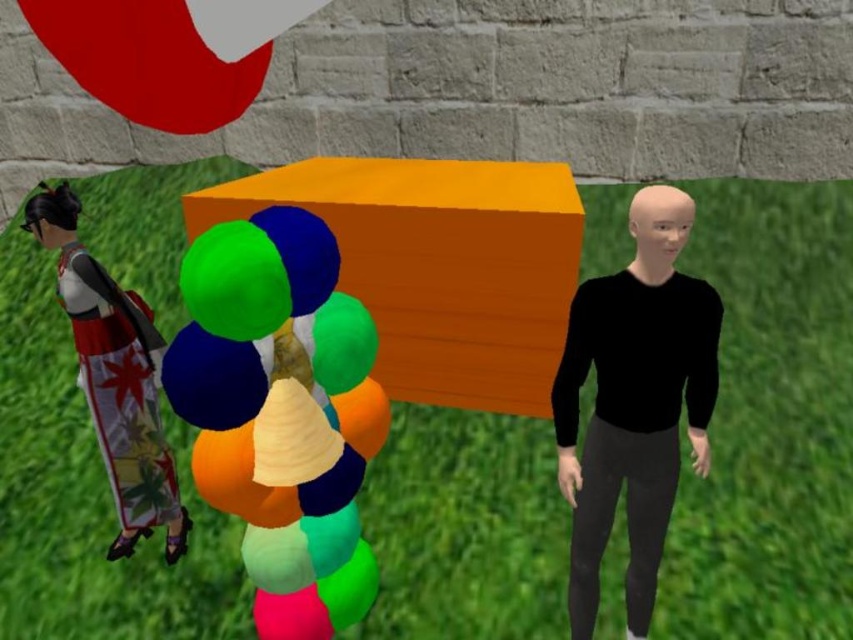
Does satin balloons at center appear under black matte mannequin at center?

No, satin balloons at center is not below black matte mannequin at center.

From the picture: Can you confirm if satin balloons at center is wider than black matte mannequin at center?

No, satin balloons at center is not wider than black matte mannequin at center.

The image size is (853, 640). I want to click on satin balloons at center, so click(281, 412).

From the picture: Is black matte mannequin at center above silk kimono doll at left?

Actually, black matte mannequin at center is below silk kimono doll at left.

Which is in front, point (672, 419) or point (149, 381)?

Point (672, 419)

The image size is (853, 640). I want to click on black matte mannequin at center, so click(634, 403).

You are a GUI agent. You are given a task and a screenshot of the screen. Output one action in this format:
    pyautogui.click(x=<x>, y=<y>)
    Task: Click on the black matte mannequin at center
    The image size is (853, 640).
    Given the screenshot: What is the action you would take?
    click(x=634, y=403)

Consider the image. Between satin balloons at center and silk kimono doll at left, which one is positioned lower?

satin balloons at center

In the scene shown: Is satin balloons at center below silk kimono doll at left?

Yes.

Which is in front, point (225, 433) or point (148, 308)?

Point (225, 433) is in front.

Locate an element on the screen. This screenshot has height=640, width=853. satin balloons at center is located at coordinates (281, 412).